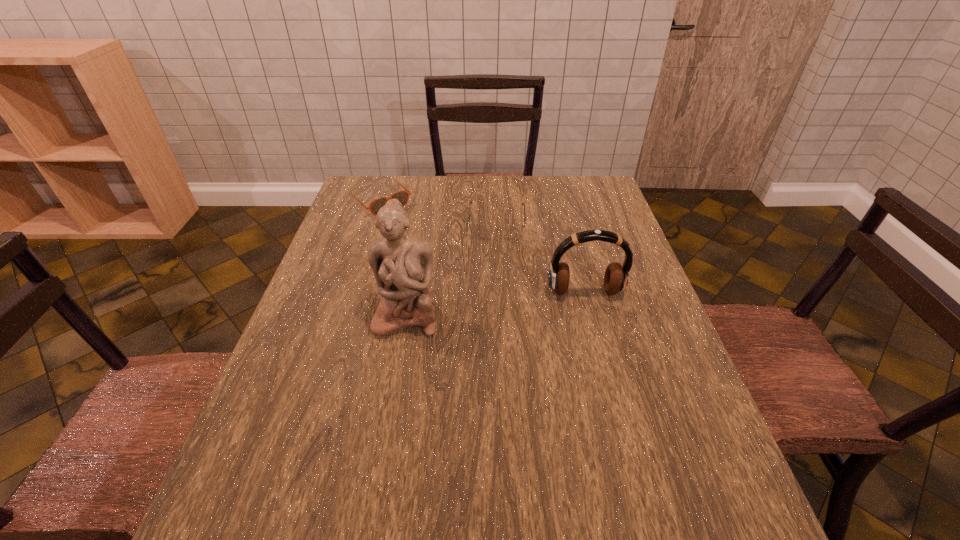
Where is `vacant space located on the front-facing side of the sunglasses`? Image resolution: width=960 pixels, height=540 pixels. vacant space located on the front-facing side of the sunglasses is located at coordinates (419, 237).

The image size is (960, 540). I want to click on vacant point located on the front-facing side of the sunglasses, so click(x=433, y=250).

The height and width of the screenshot is (540, 960). Identify the location of vacant area located on the front-facing side of the sunglasses. (424, 242).

I want to click on spectacles situated at the far edge, so (482, 231).

Image resolution: width=960 pixels, height=540 pixels. What are the coordinates of `sunglasses situated at the far edge` in the screenshot? It's located at (402, 196).

Where is `object that is at the left edge`? Image resolution: width=960 pixels, height=540 pixels. object that is at the left edge is located at coordinates (402, 196).

Find the location of a particular element. The height and width of the screenshot is (540, 960). object positioned at the right edge is located at coordinates (616, 275).

At what (x,y) coordinates should I click in order to perform the action: click on object that is positioned at the far left corner. Please return your answer as a coordinate pair (x, y). The width and height of the screenshot is (960, 540). Looking at the image, I should click on click(x=402, y=196).

Find the location of a particular element. Image resolution: width=960 pixels, height=540 pixels. vacant space at the far edge is located at coordinates (406, 177).

You are a GUI agent. You are given a task and a screenshot of the screen. Output one action in this format:
    pyautogui.click(x=<x>, y=<y>)
    Task: Click on the vacant space at the near edge of the desktop
    
    Given the screenshot: What is the action you would take?
    tap(467, 449)